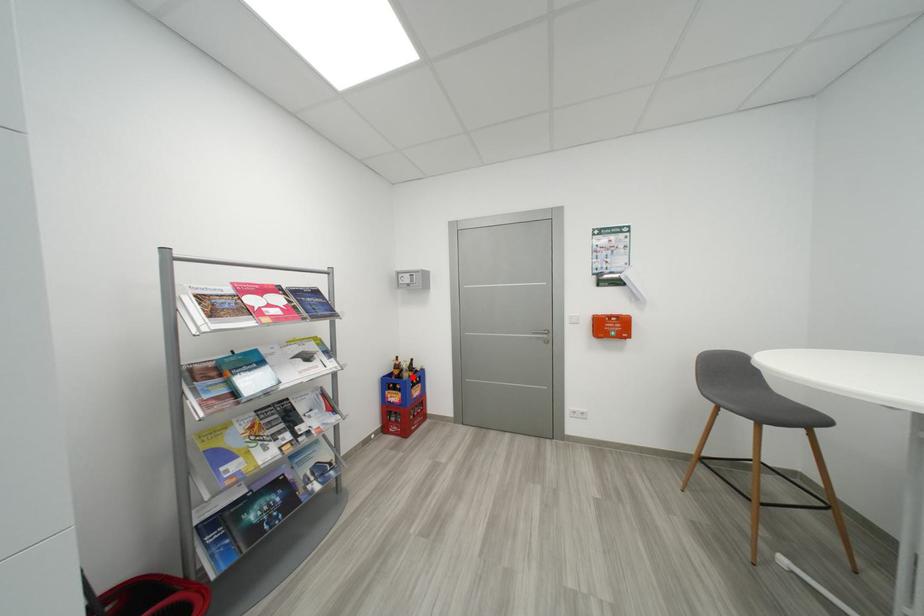
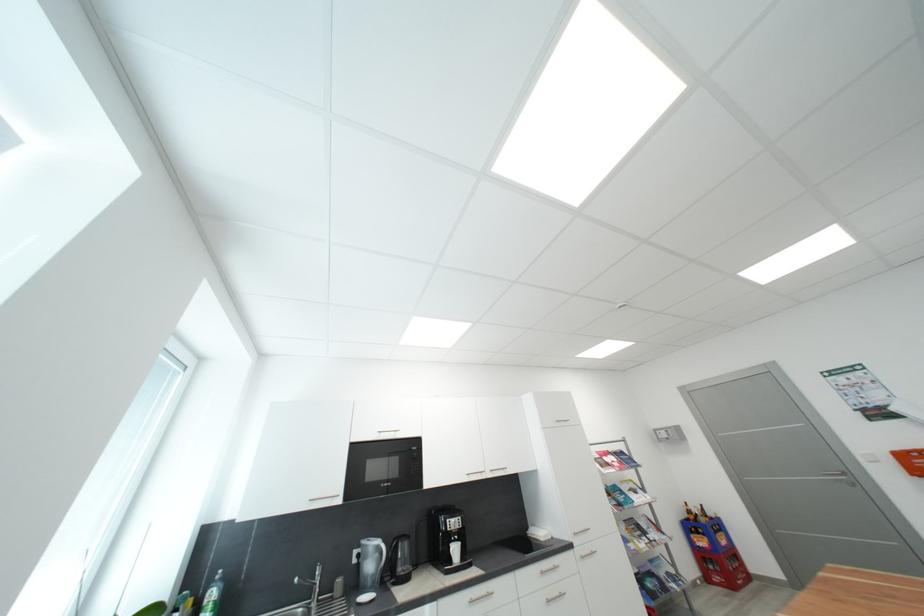
Question: A red point is marked in image1. In image2, is the corresponding 3D point closer to the camera or farther? Reply with the corresponding letter.

Choices:
 (A) The corresponding 3D point is closer.
 (B) The corresponding 3D point is farther.

Answer: (A)